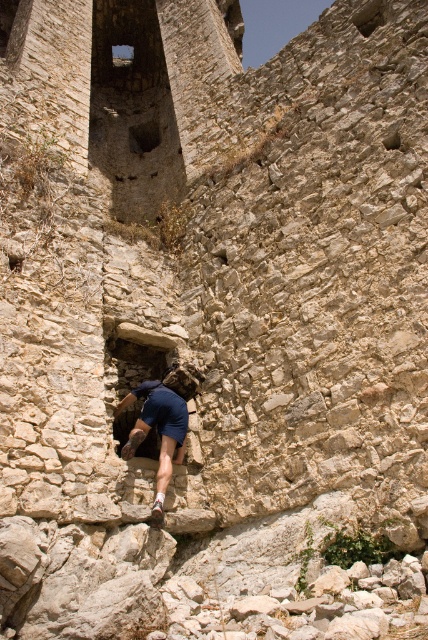
Which is in front, point (160, 404) or point (127, 387)?

Point (160, 404) is more forward.

How distant is dark blue fabric at center from stone hole at center?

dark blue fabric at center is 10.11 feet away from stone hole at center.

The height and width of the screenshot is (640, 428). What are the coordinates of `dark blue fabric at center` in the screenshot? It's located at tap(163, 422).

The height and width of the screenshot is (640, 428). Identify the location of dark blue fabric at center. (163, 422).

Is stone hole at center to the left of dark stone hole at upper center from the viewer's perspective?

No, stone hole at center is not to the left of dark stone hole at upper center.

Is stone hole at center to the right of dark stone hole at upper center from the viewer's perspective?

Yes, stone hole at center is to the right of dark stone hole at upper center.

Is point (121, 342) positioned after point (134, 125)?

That is False.

Identify the location of stone hole at center. This screenshot has height=640, width=428. (136, 364).

Between point (169, 406) and point (154, 138), which one is positioned in front?

Point (169, 406) is in front.

Who is more forward, (x=157, y=513) or (x=151, y=148)?

Point (x=157, y=513) is more forward.

Where is `dark blue fabric at center`? The width and height of the screenshot is (428, 640). dark blue fabric at center is located at coordinates (163, 422).